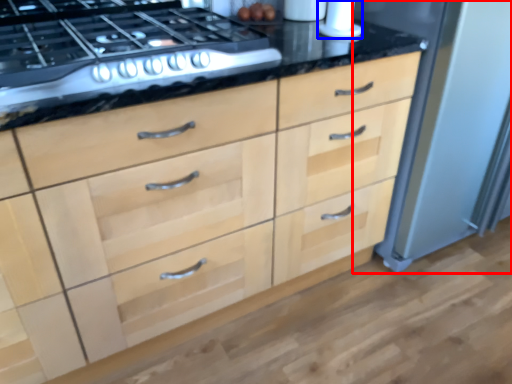
Question: Which point is closer to the camera, appliance (highlighted by a red box) or appliance (highlighted by a blue box)?

Choices:
 (A) appliance
 (B) appliance

Answer: (A)